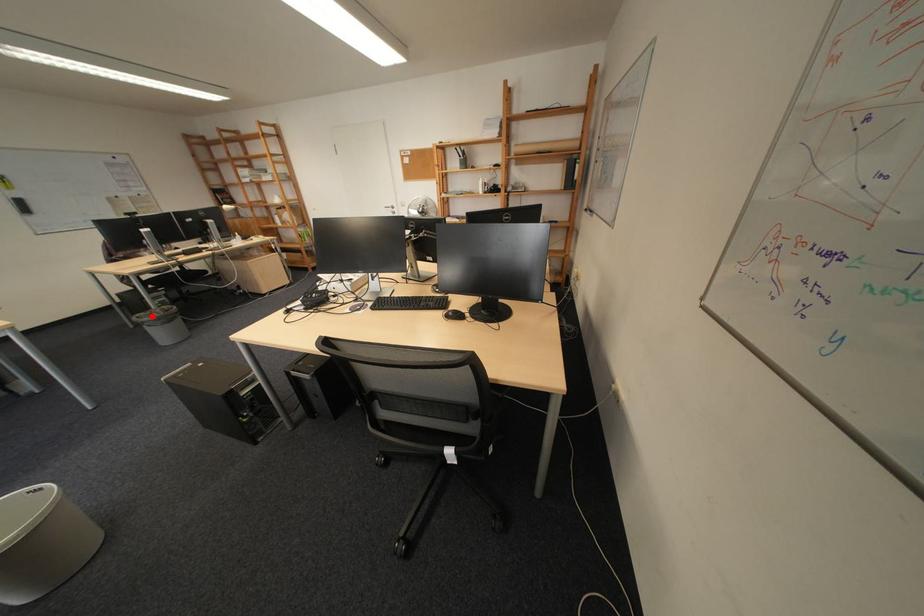
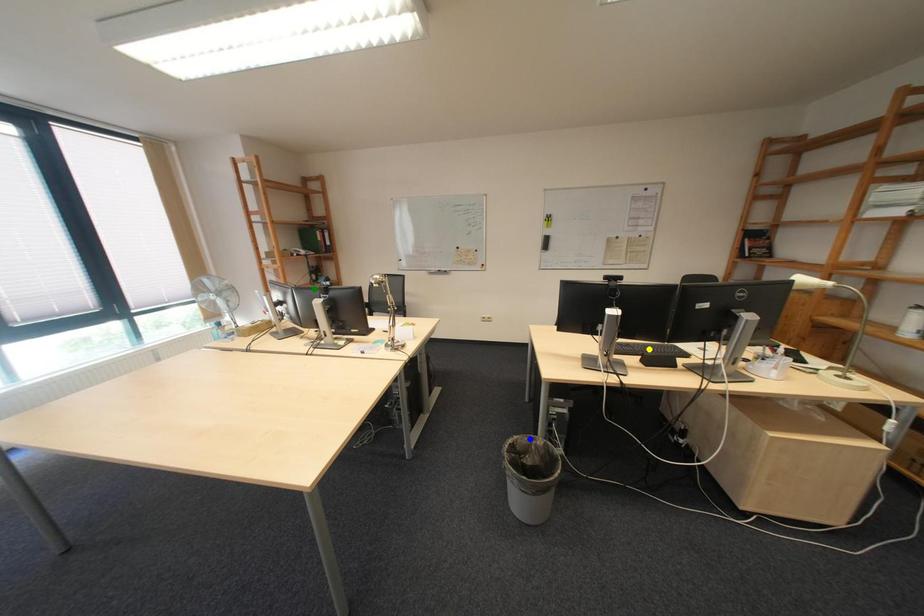
Question: I am providing you with two images of the same scene from different viewpoints. A red point is marked on the first image. You are given multiple points on the second image. Which point in image 2 represents the same 3d spot as the red point in image 1?

Choices:
 (A) blue point
 (B) yellow point
 (C) green point

Answer: (A)